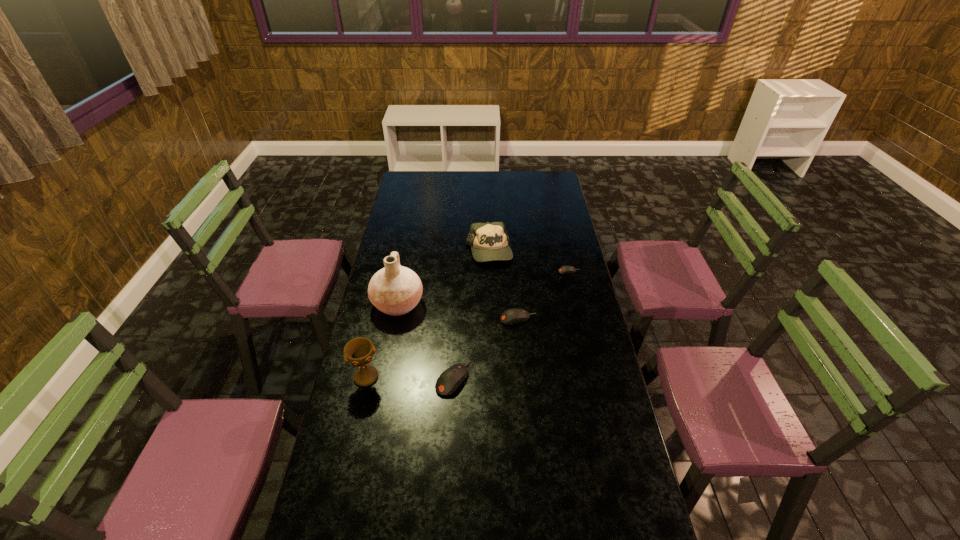
You are a GUI agent. You are given a task and a screenshot of the screen. Output one action in this format:
    pyautogui.click(x=<x>, y=<y>)
    Task: Click on the vacant space located on the front of the fifth tallest object
    
    Given the screenshot: What is the action you would take?
    pyautogui.click(x=522, y=370)

Find the location of `vacant space located on the back of the rightmost computer mouse`. vacant space located on the back of the rightmost computer mouse is located at coordinates (560, 230).

Identify the location of free space located 0.380m on the front-facing side of the farthest object. (491, 332).

In order to click on vacant area situated on the right of the chalice in this screenshot , I will do `click(442, 377)`.

At what (x,y) coordinates should I click in order to perform the action: click on blank area located to pour from the handle of the pottery. Please return your answer as a coordinate pair (x, y). The image size is (960, 540). Looking at the image, I should click on (442, 304).

At what (x,y) coordinates should I click in order to perform the action: click on chalice at the left edge. Please return your answer as a coordinate pair (x, y). This screenshot has width=960, height=540. Looking at the image, I should click on (359, 351).

The image size is (960, 540). Identify the location of pottery that is at the left edge. (395, 290).

The width and height of the screenshot is (960, 540). What are the coordinates of `object that is at the right edge` in the screenshot? It's located at [x=566, y=269].

Where is `vacant region at the far edge`? This screenshot has width=960, height=540. vacant region at the far edge is located at coordinates (501, 175).

This screenshot has width=960, height=540. Identify the location of free point at the near edge. (435, 507).